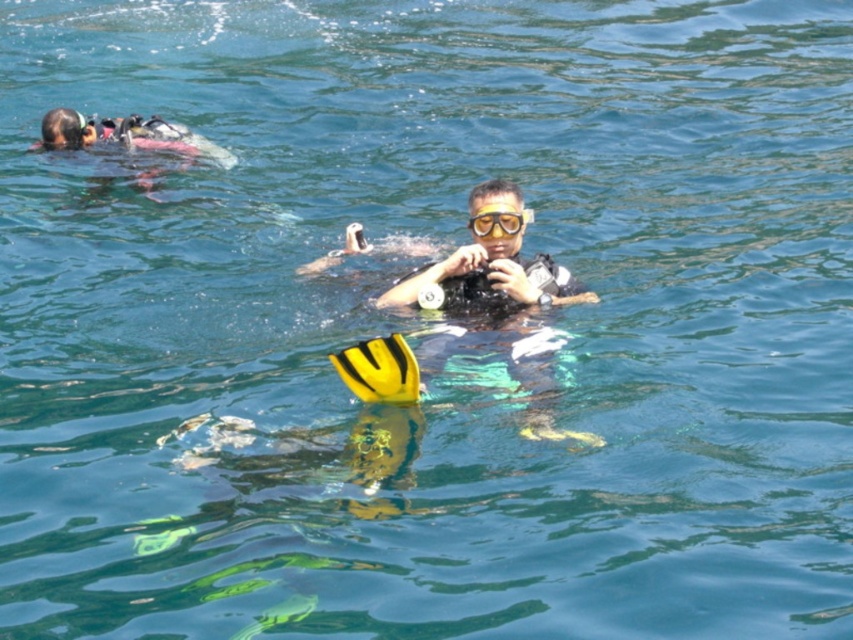
Question: Which of the following is the farthest from the observer?

Choices:
 (A) (532, 291)
 (B) (508, 227)

Answer: (B)

Question: Which point appears closest to the camera in this image?

Choices:
 (A) (496, 184)
 (B) (479, 218)

Answer: (B)

Question: Is matte black wetsuit at center positioned in front of clear plastic goggles at center?

Choices:
 (A) no
 (B) yes

Answer: (A)

Question: Does matte black wetsuit at center come in front of clear plastic goggles at center?

Choices:
 (A) yes
 (B) no

Answer: (B)

Question: Is matte black wetsuit at center in front of clear plastic goggles at center?

Choices:
 (A) yes
 (B) no

Answer: (B)